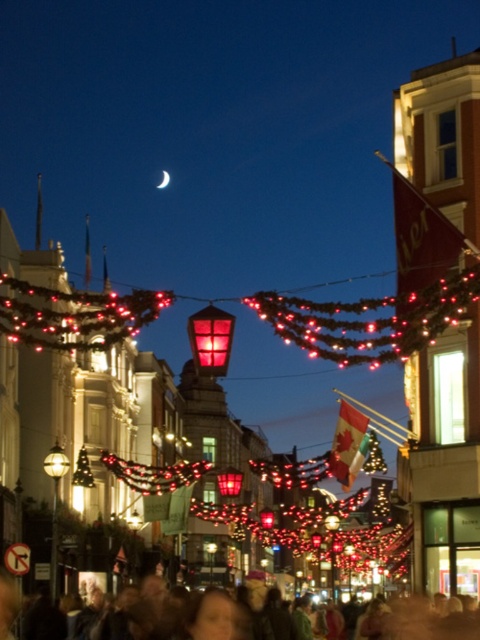
Question: Which point is farther to the camera?

Choices:
 (A) (217, 365)
 (B) (163, 182)
 (C) (243, 632)
 (D) (12, 300)

Answer: (B)

Question: Among these points, which one is nearest to the camera?

Choices:
 (A) (417, 344)
 (B) (219, 317)
 (C) (230, 625)
 (D) (168, 173)

Answer: (A)

Question: Which object is positioned farthest from the matte black crowd at center?

Choices:
 (A) silver metallic crescent moon at upper center
 (B) matte glass lantern at center

Answer: (A)

Question: Does matte glass lantern at center have a greater width compared to matte black crowd at center?

Choices:
 (A) no
 (B) yes

Answer: (B)

Question: Is matte red lantern at center above silver metallic crescent moon at upper center?

Choices:
 (A) yes
 (B) no

Answer: (B)

Question: Can you confirm if matte black crowd at center is positioned to the left of silver metallic crescent moon at upper center?

Choices:
 (A) yes
 (B) no

Answer: (B)